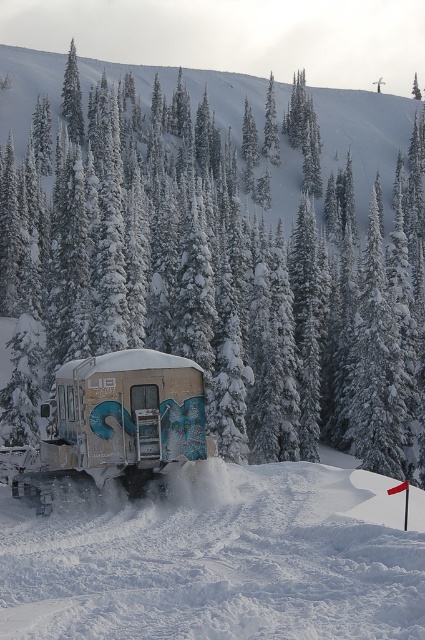
You are standing in the snowy forest and want to reach the snowplow vehicle. You see two points marked in the image. Which point is closer to you, point (252, 512) or point (116, 413)?

Point (252, 512) is closer to the viewer than point (116, 413).

You are a delivery driver who needs to park your truck in the area shown in the image. The truck requires a space larger than the rusty metallic trailer at center. Is there enough space for the truck to park in the white powdery snow at center?

The white powdery snow at center is bigger than the rusty metallic trailer at center, so yes, there is enough space for the truck to park in the white powdery snow at center since it is larger than the trailer.